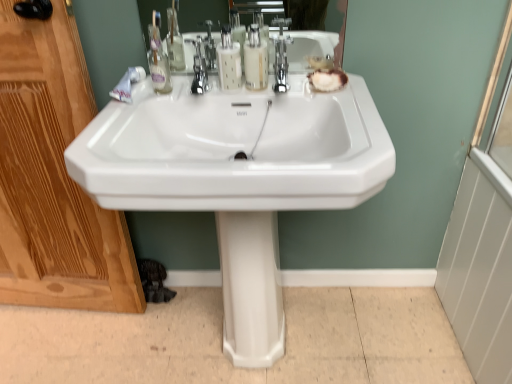
Where is `free space underneath wooden screen door at left (from a real-world perspective)`? The height and width of the screenshot is (384, 512). free space underneath wooden screen door at left (from a real-world perspective) is located at coordinates (66, 314).